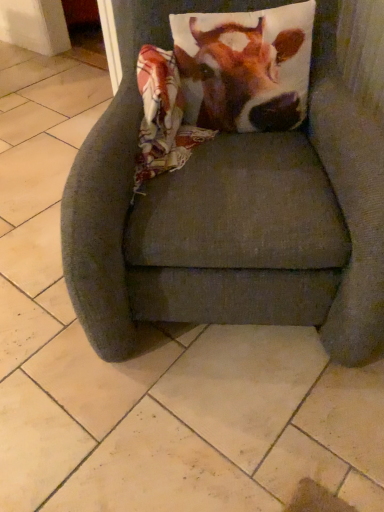
Question: In the image, is cow print pillow at upper center positioned in front of or behind dark gray fabric chair at center?

Choices:
 (A) behind
 (B) front

Answer: (A)

Question: Does point tap(299, 7) appear closer or farther from the camera than point tap(127, 173)?

Choices:
 (A) closer
 (B) farther

Answer: (B)

Question: From the image's perspective, is cow print pillow at upper center above or below dark gray fabric chair at center?

Choices:
 (A) above
 (B) below

Answer: (A)

Question: Based on their positions, is dark gray fabric chair at center located to the left or right of cow print pillow at upper center?

Choices:
 (A) right
 (B) left

Answer: (B)

Question: In the image, is dark gray fabric chair at center positioned in front of or behind cow print pillow at upper center?

Choices:
 (A) behind
 (B) front

Answer: (B)

Question: Considering the positions of point (129, 194) and point (246, 17), is point (129, 194) closer or farther from the camera than point (246, 17)?

Choices:
 (A) farther
 (B) closer

Answer: (B)

Question: Is dark gray fabric chair at center spatially inside cow print pillow at upper center, or outside of it?

Choices:
 (A) outside
 (B) inside

Answer: (A)